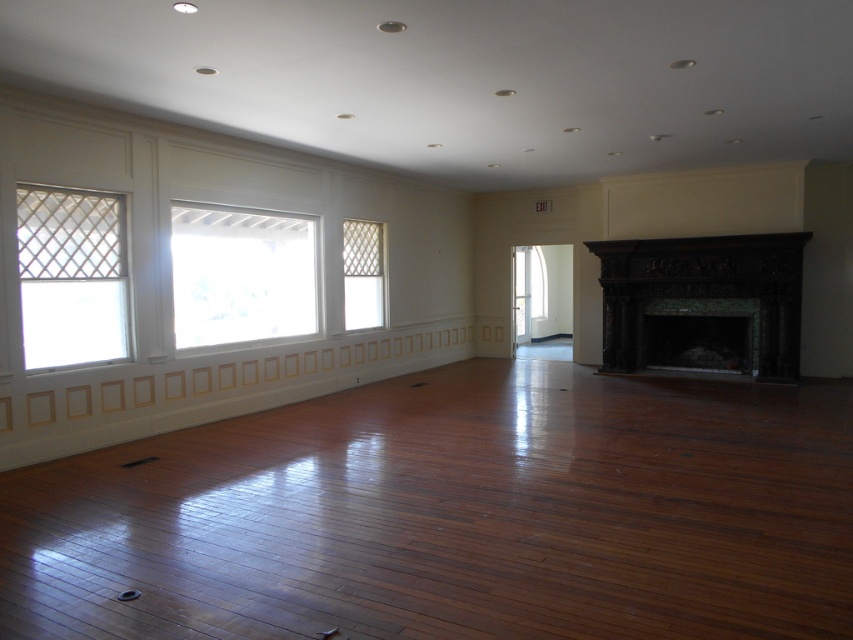
Between clear glass window at center and white lattice window at center, which one is positioned lower?

Positioned lower is clear glass window at center.

Is clear glass window at center taller than white lattice window at center?

Yes.

Where is `clear glass window at center`? clear glass window at center is located at coordinates (241, 275).

Measure the distance from dark wood fireplace at right to white lattice window at center.

dark wood fireplace at right and white lattice window at center are 4.06 meters apart from each other.

Does dark wood fireplace at right have a lesser width compared to white lattice window at center?

No.

The image size is (853, 640). Describe the element at coordinates (701, 305) in the screenshot. I see `dark wood fireplace at right` at that location.

Locate an element on the screen. This screenshot has width=853, height=640. dark wood fireplace at right is located at coordinates (701, 305).

Looking at this image, who is shorter, clear glass window at center or white lattice window at left?

white lattice window at left

Does clear glass window at center have a smaller size compared to white lattice window at left?

No, clear glass window at center is not smaller than white lattice window at left.

Who is more distant from viewer, (254, 244) or (45, 248)?

Positioned behind is point (254, 244).

Where is `clear glass window at center`? The image size is (853, 640). clear glass window at center is located at coordinates (241, 275).